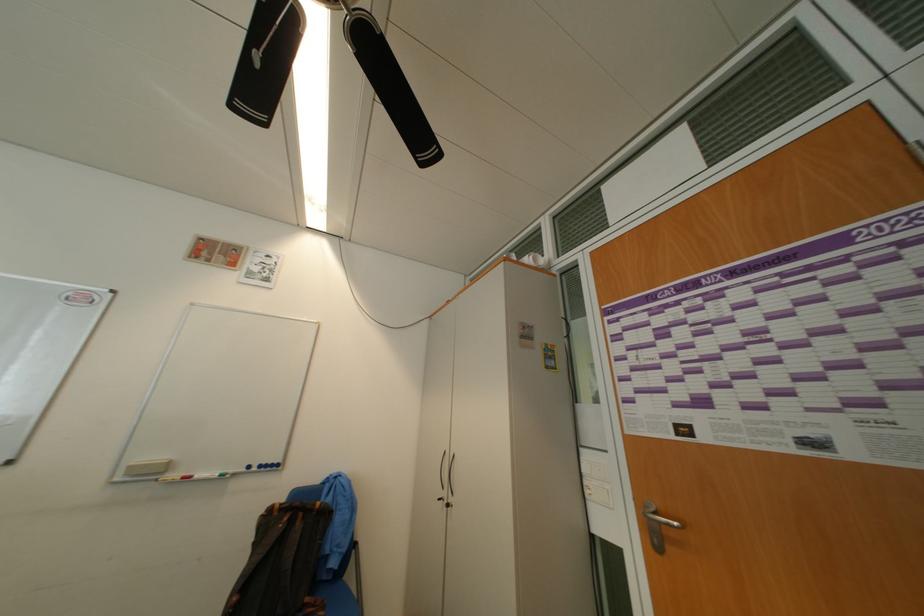
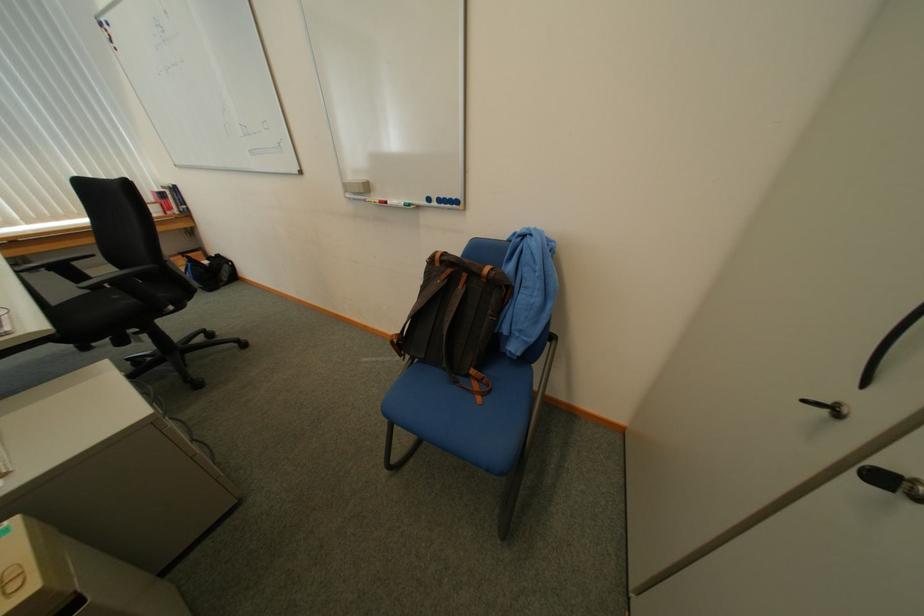
Locate, in the second image, the point that corresponds to the point at 200,477 in the first image.

(396, 204)